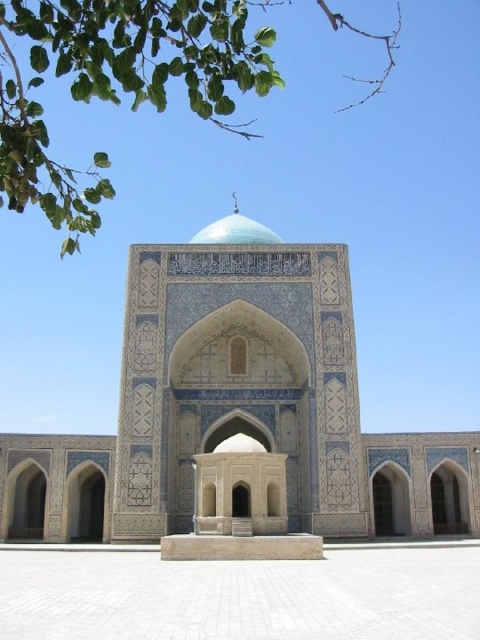
Is green leafy tree at upper left shorter than teal glazed dome at center?

No, green leafy tree at upper left is not shorter than teal glazed dome at center.

At what (x,y) coordinates should I click in order to perform the action: click on green leafy tree at upper left. Please return your answer as a coordinate pair (x, y). Looking at the image, I should click on (117, 84).

Locate an element on the screen. The image size is (480, 640). green leafy tree at upper left is located at coordinates (117, 84).